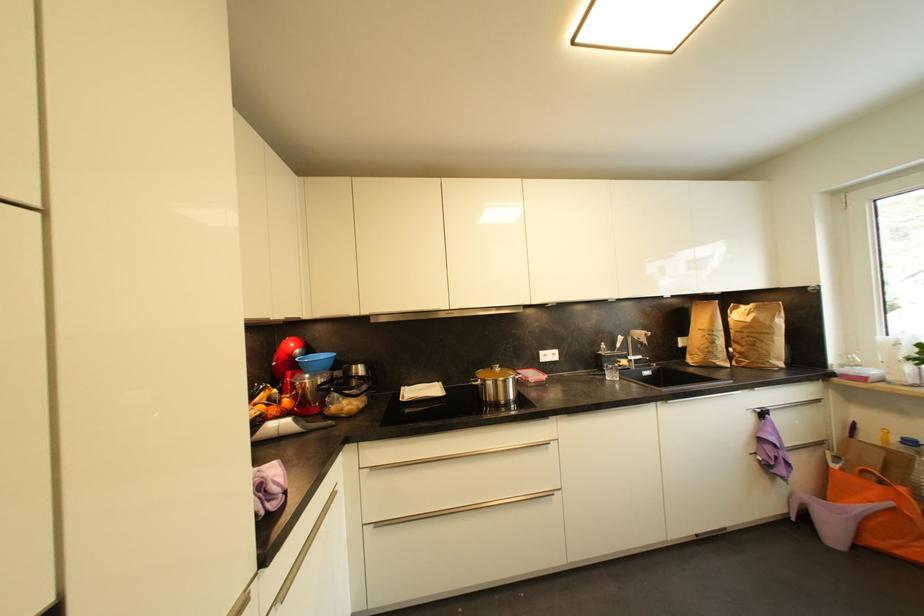
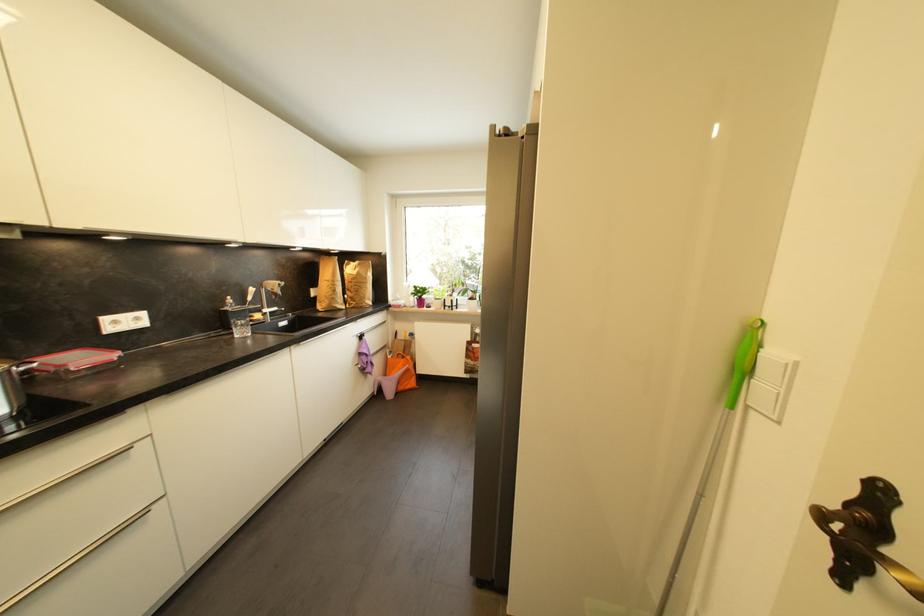
Question: I am providing you with two images of the same scene from different viewpoints. Please identify which objects are invisible in image2.

Choices:
 (A) white light switch
 (B) silver drawer handle
 (C) glass tumbler
 (D) none of these

Answer: (D)